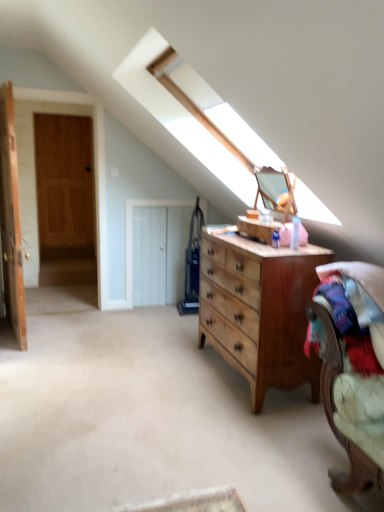
What is the approximate width of wooden dresser at center?

It is 21.64 inches.

I want to click on velvet-like beige armchair at lower right, so click(x=352, y=368).

This screenshot has width=384, height=512. What do you see at coordinates (156, 251) in the screenshot?
I see `white wooden door at center, which appears as the 1th door when viewed from the right` at bounding box center [156, 251].

In order to face white wooden door at center, positioned as the 3th door in left-to-right order, should I rotate leftwards or rightwards?

Turn left by 3.088 degrees to look at white wooden door at center, positioned as the 3th door in left-to-right order.

What do you see at coordinates (11, 218) in the screenshot? I see `wooden door at left, placed as the first door when sorted from left to right` at bounding box center [11, 218].

Identify the location of wooden door at left, which appears as the 2th door when viewed from the right. (65, 199).

Which object is more forward, velvet-like beige armchair at lower right or wooden door at left, placed as the second door when sorted from left to right?

velvet-like beige armchair at lower right.

In terms of width, does velvet-like beige armchair at lower right look wider or thinner when compared to wooden door at left, which appears as the 2th door when viewed from the right?

Considering their sizes, velvet-like beige armchair at lower right looks broader than wooden door at left, which appears as the 2th door when viewed from the right.

Is velvet-like beige armchair at lower right not inside wooden door at left, which appears as the 2th door when viewed from the right?

velvet-like beige armchair at lower right lies outside wooden door at left, which appears as the 2th door when viewed from the right,'s area.

Who is taller, wooden door at left, which appears as the 2th door when viewed from the right, or wooden dresser at center?

wooden door at left, which appears as the 2th door when viewed from the right.

Identify the location of the chest of drawers below the wooden door at left, which appears as the 2th door when viewed from the right (from the image's perspective). (259, 309).

Can you confirm if wooden door at left, placed as the second door when sorted from left to right, is bigger than wooden dresser at center?

Incorrect, wooden door at left, placed as the second door when sorted from left to right, is not larger than wooden dresser at center.

Could you tell me if wooden door at left, placed as the second door when sorted from left to right, is facing wooden dresser at center?

No, wooden door at left, placed as the second door when sorted from left to right, is not oriented towards wooden dresser at center.

The width and height of the screenshot is (384, 512). I want to click on the 1st door above the wooden dresser at center (from the image's perspective), so click(156, 251).

Could you tell me if wooden dresser at center is turned towards white wooden door at center, positioned as the 3th door in left-to-right order?

No.

Which is correct: wooden dresser at center is inside white wooden door at center, which appears as the 1th door when viewed from the right, or outside of it?

wooden dresser at center is not inside white wooden door at center, which appears as the 1th door when viewed from the right, it's outside.

Is wooden dresser at center smaller than white wooden door at center, positioned as the 3th door in left-to-right order?

Incorrect, wooden dresser at center is not smaller in size than white wooden door at center, positioned as the 3th door in left-to-right order.

Is wooden dresser at center situated inside wooden door at left, placed as the second door when sorted from left to right, or outside?

wooden dresser at center is outside wooden door at left, placed as the second door when sorted from left to right.

From a real-world perspective, between wooden dresser at center and wooden door at left, placed as the second door when sorted from left to right, who is vertically lower?

wooden dresser at center.

Locate an element on the screen. This screenshot has height=512, width=384. door that is the 2nd one when counting backward from the wooden dresser at center is located at coordinates (65, 199).

From the image's perspective, would you say wooden door at left, placed as the first door when sorted from left to right, is positioned over velvet-like beige armchair at lower right?

Yes, from the image's perspective, wooden door at left, placed as the first door when sorted from left to right, is on top of velvet-like beige armchair at lower right.

Is wooden door at left, which ranks as the 3th door in right-to-left order, to the left of velvet-like beige armchair at lower right from the viewer's perspective?

Indeed, wooden door at left, which ranks as the 3th door in right-to-left order, is positioned on the left side of velvet-like beige armchair at lower right.

Is wooden door at left, placed as the first door when sorted from left to right, turned away from velvet-like beige armchair at lower right?

No.

Does wooden door at left, which ranks as the 3th door in right-to-left order, lie behind velvet-like beige armchair at lower right?

Yes, wooden door at left, which ranks as the 3th door in right-to-left order, is further from the camera.

Is wooden door at left, placed as the first door when sorted from left to right, aimed at wooden dresser at center?

No, wooden door at left, placed as the first door when sorted from left to right, is not aimed at wooden dresser at center.

What's the angular difference between wooden door at left, placed as the first door when sorted from left to right, and wooden dresser at center's facing directions?

There is a 169-degree angle between the facing directions of wooden door at left, placed as the first door when sorted from left to right, and wooden dresser at center.

Which of these two, wooden door at left, which ranks as the 3th door in right-to-left order, or wooden dresser at center, is smaller?

wooden door at left, which ranks as the 3th door in right-to-left order, is smaller.

From a real-world perspective, is velvet-like beige armchair at lower right above or below wooden door at left, which ranks as the 3th door in right-to-left order?

Clearly, from a real-world perspective, velvet-like beige armchair at lower right is below wooden door at left, which ranks as the 3th door in right-to-left order.

Does velvet-like beige armchair at lower right have a lesser height compared to wooden door at left, placed as the first door when sorted from left to right?

Indeed, velvet-like beige armchair at lower right has a lesser height compared to wooden door at left, placed as the first door when sorted from left to right.

Considering the relative positions of velvet-like beige armchair at lower right and wooden door at left, placed as the first door when sorted from left to right, in the image provided, is velvet-like beige armchair at lower right to the left of wooden door at left, placed as the first door when sorted from left to right, from the viewer's perspective?

In fact, velvet-like beige armchair at lower right is to the right of wooden door at left, placed as the first door when sorted from left to right.

Relative to wooden door at left, placed as the first door when sorted from left to right, is velvet-like beige armchair at lower right in front or behind?

Clearly, velvet-like beige armchair at lower right is in front of wooden door at left, placed as the first door when sorted from left to right.

From the image's perspective, count 3rd doors upward from the velvet-like beige armchair at lower right and point to it. Please provide its 2D coordinates.

[(65, 199)]

This screenshot has height=512, width=384. In order to click on the 2nd door behind the wooden dresser at center, starting your count from the anchor in this screenshot , I will do `click(65, 199)`.

Estimate the real-world distances between objects in this image. Which object is further from velvet-like beige armchair at lower right, wooden door at left, placed as the second door when sorted from left to right, or wooden dresser at center?

Among the two, wooden door at left, placed as the second door when sorted from left to right, is located further to velvet-like beige armchair at lower right.

Based on their spatial positions, is white wooden door at center, positioned as the 3th door in left-to-right order, or wooden dresser at center closer to wooden door at left, placed as the second door when sorted from left to right?

Based on the image, white wooden door at center, positioned as the 3th door in left-to-right order, appears to be nearer to wooden door at left, placed as the second door when sorted from left to right.

When comparing their distances from velvet-like beige armchair at lower right, does wooden dresser at center or wooden door at left, which ranks as the 3th door in right-to-left order, seem further?

wooden door at left, which ranks as the 3th door in right-to-left order, is further to velvet-like beige armchair at lower right.

Based on their spatial positions, is wooden door at left, placed as the first door when sorted from left to right, or wooden door at left, which appears as the 2th door when viewed from the right, further from velvet-like beige armchair at lower right?

wooden door at left, which appears as the 2th door when viewed from the right, is positioned further to the anchor velvet-like beige armchair at lower right.

Estimate the real-world distances between objects in this image. Which object is closer to wooden door at left, placed as the first door when sorted from left to right, wooden door at left, placed as the second door when sorted from left to right, or velvet-like beige armchair at lower right?

wooden door at left, placed as the second door when sorted from left to right.

When comparing their distances from white wooden door at center, positioned as the 3th door in left-to-right order, does velvet-like beige armchair at lower right or wooden door at left, which ranks as the 3th door in right-to-left order, seem closer?

wooden door at left, which ranks as the 3th door in right-to-left order, lies closer to white wooden door at center, positioned as the 3th door in left-to-right order, than the other object.

From the image, which object appears to be farther from wooden dresser at center, white wooden door at center, positioned as the 3th door in left-to-right order, or velvet-like beige armchair at lower right?

Among the two, white wooden door at center, positioned as the 3th door in left-to-right order, is located further to wooden dresser at center.

From the image, which object appears to be nearer to wooden door at left, placed as the first door when sorted from left to right, velvet-like beige armchair at lower right or white wooden door at center, positioned as the 3th door in left-to-right order?

white wooden door at center, positioned as the 3th door in left-to-right order, is positioned closer to the anchor wooden door at left, placed as the first door when sorted from left to right.

Where is `door between wooden door at left, placed as the first door when sorted from left to right, and white wooden door at center, positioned as the 3th door in left-to-right order`? The image size is (384, 512). door between wooden door at left, placed as the first door when sorted from left to right, and white wooden door at center, positioned as the 3th door in left-to-right order is located at coordinates pyautogui.click(x=65, y=199).

Find the location of `the chest of drawers situated between wooden door at left, placed as the first door when sorted from left to right, and velvet-like beige armchair at lower right from left to right`. the chest of drawers situated between wooden door at left, placed as the first door when sorted from left to right, and velvet-like beige armchair at lower right from left to right is located at coordinates (259, 309).

I want to click on the chest of drawers situated between wooden door at left, which appears as the 2th door when viewed from the right, and velvet-like beige armchair at lower right from left to right, so click(259, 309).

This screenshot has width=384, height=512. I want to click on chest of drawers between velvet-like beige armchair at lower right and white wooden door at center, which appears as the 1th door when viewed from the right, from front to back, so click(259, 309).